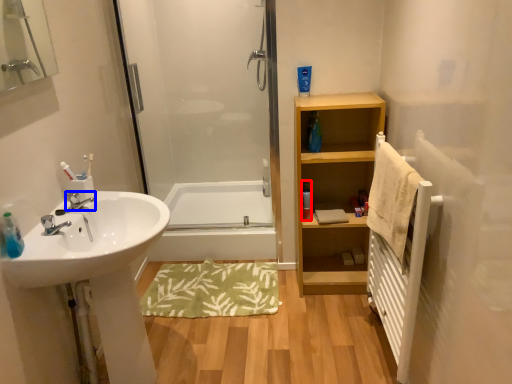
Question: Which object is closer to the camera taking this photo, toiletry (highlighted by a red box) or tap (highlighted by a blue box)?

Choices:
 (A) toiletry
 (B) tap

Answer: (B)